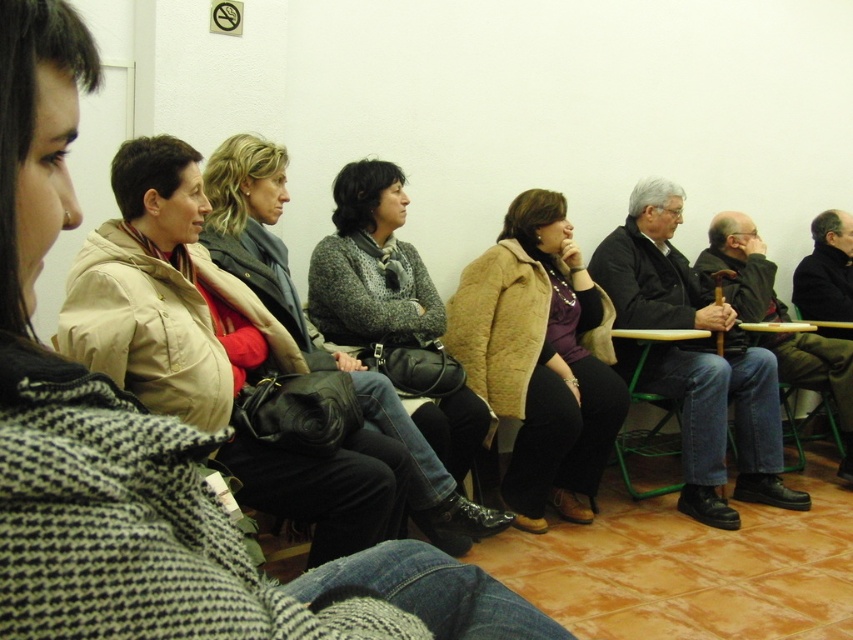
You are a person who wants to place your beige fuzzy coat at center and your matte black purse at center on the green metal chair with wooden top. Which item will require more space on the chair?

The matte black purse at center requires more space on the chair because the beige fuzzy coat at center has a smaller size compared to matte black purse at center.

You are a person who is 1.7 meters tall and wants to sit on the green metal chair at lower center. There is a beige fuzzy coat at center in front of you. Can you sit down without the coat blocking your view?

The beige fuzzy coat at center is taller than the green metal chair at lower center, so it might block your view when sitting down. Move the coat aside or choose a different seat.